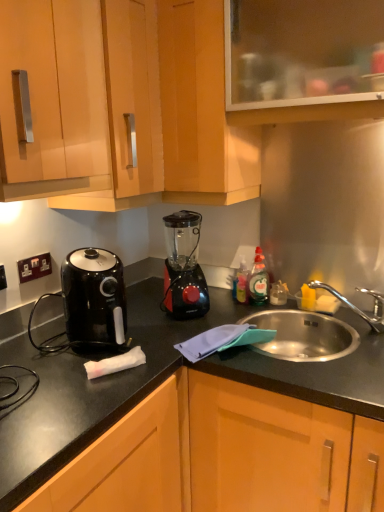
Question: Is black glossy air fryer at left taller than black plastic electrical outlet at left, the second electric outlet positioned from the left?

Choices:
 (A) yes
 (B) no

Answer: (A)

Question: From a real-world perspective, is black glossy air fryer at left on top of black plastic electrical outlet at left, arranged as the first electric outlet when viewed from the back?

Choices:
 (A) yes
 (B) no

Answer: (B)

Question: Does black glossy air fryer at left have a smaller size compared to black plastic electrical outlet at left, the first electric outlet viewed from the right?

Choices:
 (A) no
 (B) yes

Answer: (A)

Question: From a real-world perspective, is black glossy air fryer at left below black plastic electrical outlet at left, the second electric outlet positioned from the left?

Choices:
 (A) yes
 (B) no

Answer: (A)

Question: Is black plastic electrical outlet at left, the second electric outlet positioned from the left, a part of black glossy air fryer at left?

Choices:
 (A) no
 (B) yes

Answer: (A)

Question: Considering the positions of black plastic blender at center and transparent glass cabinet at upper center, marked as the fifth cabinetry in a bottom-to-top arrangement, in the image, is black plastic blender at center wider or thinner than transparent glass cabinet at upper center, marked as the fifth cabinetry in a bottom-to-top arrangement,?

Choices:
 (A) wide
 (B) thin

Answer: (B)

Question: From a real-world perspective, relative to transparent glass cabinet at upper center, marked as the fifth cabinetry in a bottom-to-top arrangement, is black plastic blender at center vertically above or below?

Choices:
 (A) below
 (B) above

Answer: (A)

Question: Considering their positions, is black plastic blender at center located in front of or behind transparent glass cabinet at upper center, placed as the 1th cabinetry when sorted from top to bottom?

Choices:
 (A) front
 (B) behind

Answer: (B)

Question: Considering the relative positions of black plastic blender at center and transparent glass cabinet at upper center, placed as the 1th cabinetry when sorted from top to bottom, in the image provided, is black plastic blender at center to the left or to the right of transparent glass cabinet at upper center, placed as the 1th cabinetry when sorted from top to bottom,?

Choices:
 (A) right
 (B) left

Answer: (B)

Question: In terms of height, does matte wood cabinets at upper center, which appears as the 3th cabinetry when ordered from the bottom, look taller or shorter compared to transparent glass cabinet at upper center, placed as the 1th cabinetry when sorted from top to bottom?

Choices:
 (A) tall
 (B) short

Answer: (A)

Question: Choose the correct answer: Is matte wood cabinets at upper center, which appears as the 3th cabinetry when ordered from the bottom, inside transparent glass cabinet at upper center, placed as the 1th cabinetry when sorted from top to bottom, or outside it?

Choices:
 (A) inside
 (B) outside

Answer: (B)

Question: Looking at the image, does matte wood cabinets at upper center, which appears as the 3th cabinetry when ordered from the bottom, seem bigger or smaller compared to transparent glass cabinet at upper center, marked as the fifth cabinetry in a bottom-to-top arrangement?

Choices:
 (A) big
 (B) small

Answer: (A)

Question: Looking at their shapes, would you say matte wood cabinets at upper center, the third cabinetry from the top, is wider or thinner than transparent glass cabinet at upper center, placed as the 1th cabinetry when sorted from top to bottom?

Choices:
 (A) wide
 (B) thin

Answer: (A)

Question: Is wooden cabinet at lower center, which appears as the 5th cabinetry when viewed from the top, taller or shorter than black plastic electric outlet at lower left, which is counted as the second electric outlet, starting from the back?

Choices:
 (A) tall
 (B) short

Answer: (A)

Question: From the image's perspective, relative to black plastic electric outlet at lower left, positioned as the first electric outlet in front-to-back order, is wooden cabinet at lower center, which appears as the 5th cabinetry when viewed from the top, above or below?

Choices:
 (A) below
 (B) above

Answer: (A)